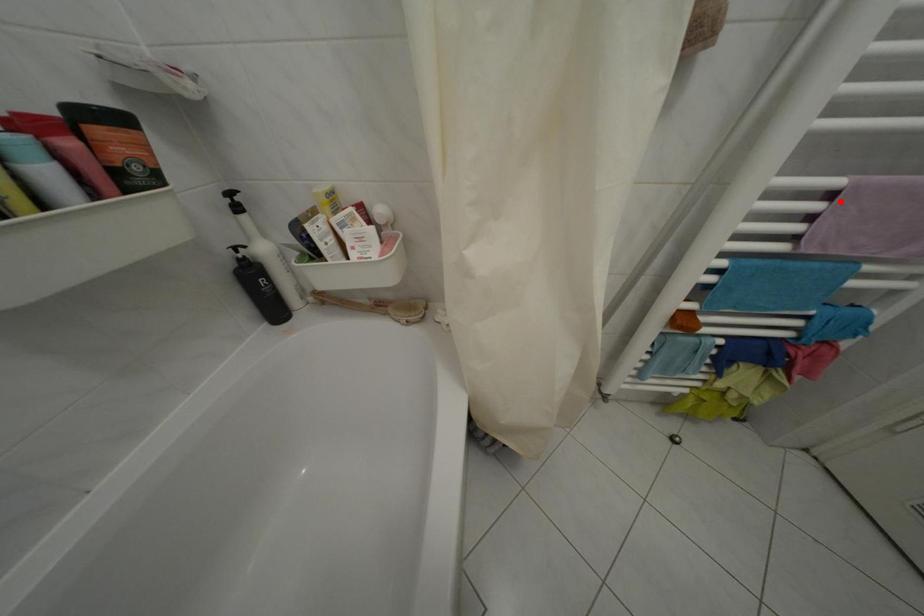
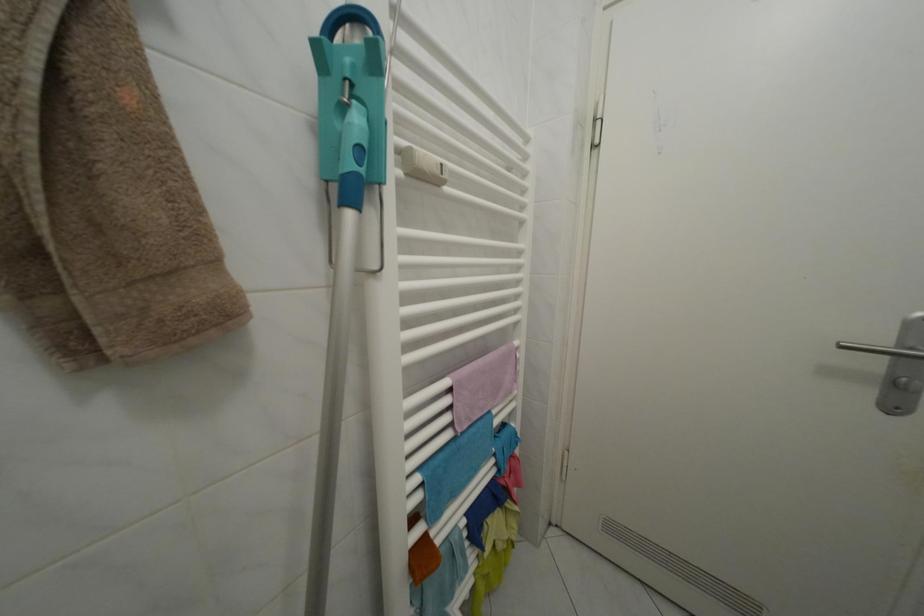
Locate, in the second image, the point that corresponds to the highlighted location in the first image.

(458, 397)